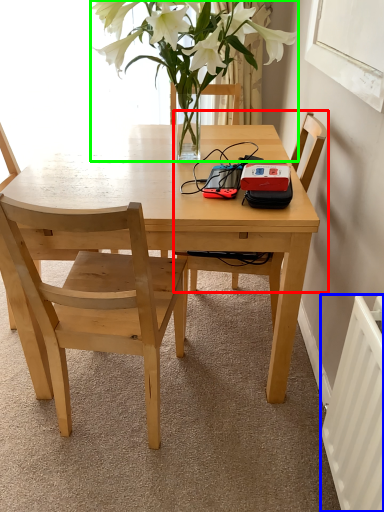
Question: Considering the real-world distances, which object is closest to chair (highlighted by a red box)? radiator (highlighted by a blue box) or houseplant (highlighted by a green box).

Choices:
 (A) radiator
 (B) houseplant

Answer: (B)